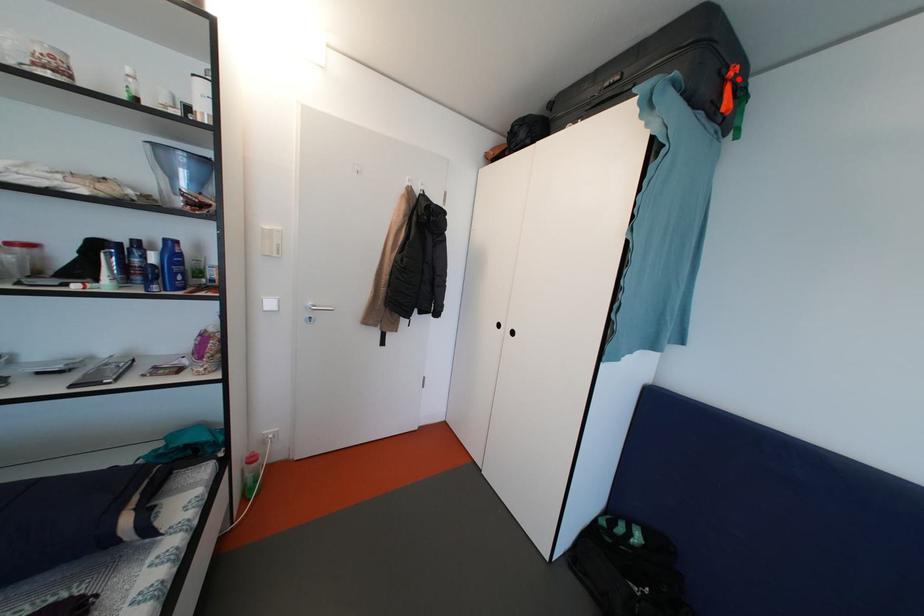
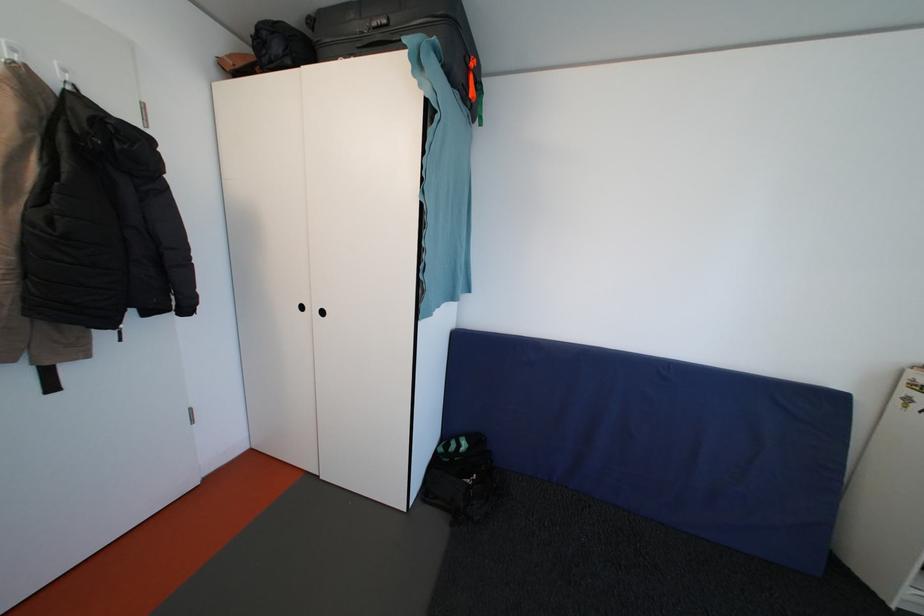
Question: I am providing you with two images of the same scene from different viewpoints. In image1, a red point is highlighted. Considering the same 3D point in image2, which of the following is correct?

Choices:
 (A) It is closer
 (B) It is farther

Answer: (A)